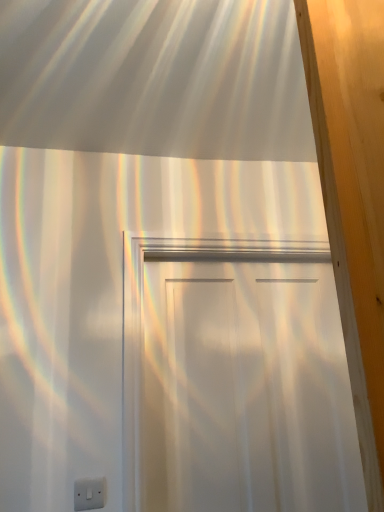
What do you see at coordinates (89, 494) in the screenshot? Image resolution: width=384 pixels, height=512 pixels. I see `white plastic electric outlet at lower left` at bounding box center [89, 494].

I want to click on white plastic electric outlet at lower left, so click(89, 494).

In order to face white matte door at center, should I rotate leftwards or rightwards?

You should rotate right by 8.339 degrees.

The height and width of the screenshot is (512, 384). What do you see at coordinates (247, 390) in the screenshot? I see `white matte door at center` at bounding box center [247, 390].

Image resolution: width=384 pixels, height=512 pixels. I want to click on white matte door at center, so click(x=247, y=390).

Find the location of a particular element. white plastic electric outlet at lower left is located at coordinates (89, 494).

Is white plastic electric outlet at lower left to the left of white matte door at center from the viewer's perspective?

Correct, you'll find white plastic electric outlet at lower left to the left of white matte door at center.

Looking at this image, considering the positions of objects white plastic electric outlet at lower left and white matte door at center in the image provided, who is in front, white plastic electric outlet at lower left or white matte door at center?

Positioned in front is white plastic electric outlet at lower left.

Between point (81, 481) and point (304, 496), which one is positioned behind?

The point (304, 496) is behind.

From the image's perspective, which is below, white plastic electric outlet at lower left or white matte door at center?

white plastic electric outlet at lower left is shown below in the image.

From a real-world perspective, is white plastic electric outlet at lower left physically located above or below white matte door at center?

white plastic electric outlet at lower left is below white matte door at center.

Can you confirm if white plastic electric outlet at lower left is thinner than white matte door at center?

Yes, white plastic electric outlet at lower left is thinner than white matte door at center.

Consider the image. Can you confirm if white plastic electric outlet at lower left is taller than white matte door at center?

No.

Does white plastic electric outlet at lower left have a smaller size compared to white matte door at center?

Yes, white plastic electric outlet at lower left is smaller than white matte door at center.

Is white plastic electric outlet at lower left surrounding white matte door at center?

Definitely not — white matte door at center is not inside white plastic electric outlet at lower left.

Would you consider white plastic electric outlet at lower left to be distant from white matte door at center?

No, white plastic electric outlet at lower left is not far from white matte door at center.

Is white plastic electric outlet at lower left oriented towards white matte door at center?

No, white plastic electric outlet at lower left is not facing towards white matte door at center.

You are a GUI agent. You are given a task and a screenshot of the screen. Output one action in this format:
    pyautogui.click(x=<x>, y=<y>)
    Task: Click on the door lying behind the white plastic electric outlet at lower left
    This screenshot has height=512, width=384.
    Given the screenshot: What is the action you would take?
    pyautogui.click(x=247, y=390)

From the picture: Is white matte door at center to the left of white plastic electric outlet at lower left from the viewer's perspective?

In fact, white matte door at center is to the right of white plastic electric outlet at lower left.

Who is more distant, white matte door at center or white plastic electric outlet at lower left?

Positioned behind is white matte door at center.

Which is nearer, [177,346] or [85,509]?

The point [85,509] is in front.

From the image's perspective, which is below, white matte door at center or white plastic electric outlet at lower left?

white plastic electric outlet at lower left is shown below in the image.

From a real-world perspective, who is located lower, white matte door at center or white plastic electric outlet at lower left?

From a 3D spatial view, white plastic electric outlet at lower left is below.

Can you confirm if white matte door at center is thinner than white plastic electric outlet at lower left?

Incorrect, the width of white matte door at center is not less than that of white plastic electric outlet at lower left.

Between white matte door at center and white plastic electric outlet at lower left, which one has less height?

Standing shorter between the two is white plastic electric outlet at lower left.

Does white matte door at center have a smaller size compared to white plastic electric outlet at lower left?

No, white matte door at center is not smaller than white plastic electric outlet at lower left.

From the picture: Is white matte door at center situated inside white plastic electric outlet at lower left or outside?

The correct answer is: outside.

Is white matte door at center next to white plastic electric outlet at lower left and touching it?

There is a gap between white matte door at center and white plastic electric outlet at lower left.

From the picture: Could you tell me if white matte door at center is turned towards white plastic electric outlet at lower left?

No, white matte door at center is not turned towards white plastic electric outlet at lower left.

What's the angular difference between white matte door at center and white plastic electric outlet at lower left's facing directions?

The angle between the facing direction of white matte door at center and the facing direction of white plastic electric outlet at lower left is 3.33 degrees.

This screenshot has height=512, width=384. I want to click on electric outlet below the white matte door at center (from a real-world perspective), so click(89, 494).

The height and width of the screenshot is (512, 384). What are the coordinates of `door behind the white plastic electric outlet at lower left` in the screenshot? It's located at (247, 390).

Locate an element on the screen. electric outlet located below the white matte door at center (from the image's perspective) is located at coordinates (89, 494).